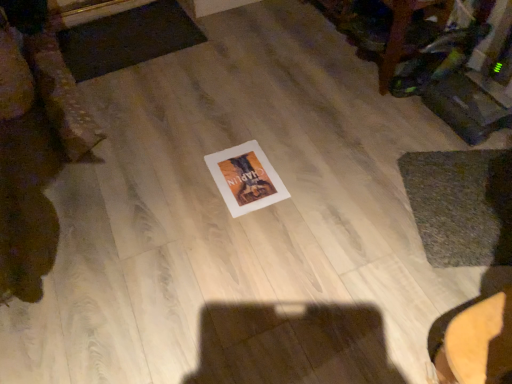
This screenshot has height=384, width=512. In order to click on green textured mat at lower right, which is counted as the 2th mat, starting from the left in this screenshot , I will do `click(461, 205)`.

Consider the image. Measure the distance between point (247, 173) and camera.

The distance of point (247, 173) from camera is 4.92 feet.

What do you see at coordinates (127, 39) in the screenshot?
I see `dark gray textured mat at upper left, which appears as the 1th mat when viewed from the top` at bounding box center [127, 39].

The image size is (512, 384). What are the coordinates of `wooden table at upper right` in the screenshot? It's located at (396, 38).

Considering the sizes of objects white paper at center and green textured mat at lower right, which is counted as the 2th mat, starting from the left, in the image provided, who is wider, white paper at center or green textured mat at lower right, which is counted as the 2th mat, starting from the left,?

Wider between the two is green textured mat at lower right, which is counted as the 2th mat, starting from the left.

Is white paper at center far from green textured mat at lower right, the 1th mat in the right-to-left sequence?

No, there isn't a large distance between white paper at center and green textured mat at lower right, the 1th mat in the right-to-left sequence.

From a real-world perspective, is white paper at center physically above green textured mat at lower right, marked as the second mat in a top-to-bottom arrangement?

Actually, white paper at center is physically below green textured mat at lower right, marked as the second mat in a top-to-bottom arrangement, in the real world.

Is white paper at center taller or shorter than green textured mat at lower right, marked as the second mat in a top-to-bottom arrangement?

white paper at center is shorter than green textured mat at lower right, marked as the second mat in a top-to-bottom arrangement.

How distant is dark gray textured mat at upper left, placed as the 2th mat when sorted from bottom to top, from green textured mat at lower right, which is counted as the 2th mat, starting from the back?

The distance of dark gray textured mat at upper left, placed as the 2th mat when sorted from bottom to top, from green textured mat at lower right, which is counted as the 2th mat, starting from the back, is 1.36 meters.

Where is `mat lying on the right of dark gray textured mat at upper left, which is the 2th mat in right-to-left order`? mat lying on the right of dark gray textured mat at upper left, which is the 2th mat in right-to-left order is located at coordinates (461, 205).

Relative to green textured mat at lower right, marked as the 1th mat in a bottom-to-top arrangement, is dark gray textured mat at upper left, which is the 1th mat from left to right, in front or behind?

Clearly, dark gray textured mat at upper left, which is the 1th mat from left to right, is behind green textured mat at lower right, marked as the 1th mat in a bottom-to-top arrangement.

Could dark gray textured mat at upper left, which is counted as the second mat, starting from the front, be considered to be inside wooden table at upper right?

No, dark gray textured mat at upper left, which is counted as the second mat, starting from the front, is not inside wooden table at upper right.

From the image's perspective, would you say wooden table at upper right is positioned over dark gray textured mat at upper left, the 1th mat viewed from the back?

Indeed, from the image's perspective, wooden table at upper right is shown above dark gray textured mat at upper left, the 1th mat viewed from the back.

From a real-world perspective, relative to dark gray textured mat at upper left, the 1th mat viewed from the back, is wooden table at upper right vertically above or below?

Clearly, from a real-world perspective, wooden table at upper right is above dark gray textured mat at upper left, the 1th mat viewed from the back.

Would you say wooden table at upper right is a long distance from dark gray textured mat at upper left, which is the 2th mat in right-to-left order?

No, there isn't a large distance between wooden table at upper right and dark gray textured mat at upper left, which is the 2th mat in right-to-left order.

Is white paper at center placed right next to dark gray textured mat at upper left, which is the 2th mat in right-to-left order?

white paper at center and dark gray textured mat at upper left, which is the 2th mat in right-to-left order, are not in contact.

Is white paper at center oriented towards dark gray textured mat at upper left, which appears as the 1th mat when viewed from the top?

No, white paper at center is not turned towards dark gray textured mat at upper left, which appears as the 1th mat when viewed from the top.

Between white paper at center and dark gray textured mat at upper left, placed as the 2th mat when sorted from bottom to top, which one has smaller size?

With smaller size is white paper at center.

Considering the points (252, 181) and (195, 37), which point is in front, point (252, 181) or point (195, 37)?

The point (252, 181) is in front.

Could you tell me if white paper at center is turned towards wooden table at upper right?

No, white paper at center is not facing towards wooden table at upper right.

From their relative heights in the image, would you say white paper at center is taller or shorter than wooden table at upper right?

Clearly, white paper at center is shorter compared to wooden table at upper right.

The width and height of the screenshot is (512, 384). Find the location of `postcard on the left of wooden table at upper right`. postcard on the left of wooden table at upper right is located at coordinates (246, 178).

Which object is more forward, dark gray textured mat at upper left, placed as the 2th mat when sorted from bottom to top, or wooden table at upper right?

wooden table at upper right is closer to the camera.

Which of these two, dark gray textured mat at upper left, the 1th mat viewed from the back, or wooden table at upper right, is bigger?

With larger size is wooden table at upper right.

From the image's perspective, is dark gray textured mat at upper left, placed as the 2th mat when sorted from bottom to top, below wooden table at upper right?

Yes, from the image's perspective, dark gray textured mat at upper left, placed as the 2th mat when sorted from bottom to top, is beneath wooden table at upper right.

Is dark gray textured mat at upper left, the 1th mat viewed from the back, turned away from wooden table at upper right?

dark gray textured mat at upper left, the 1th mat viewed from the back, is not turned away from wooden table at upper right.

Considering the relative sizes of wooden table at upper right and green textured mat at lower right, which is counted as the 2th mat, starting from the left, in the image provided, is wooden table at upper right taller than green textured mat at lower right, which is counted as the 2th mat, starting from the left,?

Yes, wooden table at upper right is taller than green textured mat at lower right, which is counted as the 2th mat, starting from the left.

Considering the sizes of wooden table at upper right and green textured mat at lower right, which appears as the 1th mat when viewed from the front, in the image, is wooden table at upper right bigger or smaller than green textured mat at lower right, which appears as the 1th mat when viewed from the front,?

Considering their sizes, wooden table at upper right takes up more space than green textured mat at lower right, which appears as the 1th mat when viewed from the front.

Is the position of wooden table at upper right less distant than that of green textured mat at lower right, which is counted as the 2th mat, starting from the left?

No, it is not.

Is wooden table at upper right inside or outside of green textured mat at lower right, which appears as the 1th mat when viewed from the front?

The correct answer is: outside.

At what (x,y) coordinates should I click in order to perform the action: click on the 2nd mat directly above the white paper at center (from a real-world perspective). Please return your answer as a coordinate pair (x, y). The image size is (512, 384). Looking at the image, I should click on click(x=461, y=205).

The width and height of the screenshot is (512, 384). What are the coordinates of `mat that is below the dark gray textured mat at upper left, placed as the 2th mat when sorted from bottom to top (from the image's perspective)` in the screenshot? It's located at (461, 205).

When comparing their distances from white paper at center, does wooden table at upper right or green textured mat at lower right, the 1th mat in the right-to-left sequence, seem closer?

The object closer to white paper at center is green textured mat at lower right, the 1th mat in the right-to-left sequence.

When comparing their distances from wooden table at upper right, does dark gray textured mat at upper left, which is counted as the second mat, starting from the front, or green textured mat at lower right, the 1th mat in the right-to-left sequence, seem closer?

green textured mat at lower right, the 1th mat in the right-to-left sequence, is closer to wooden table at upper right.

Looking at the image, which one is located further to green textured mat at lower right, marked as the second mat in a top-to-bottom arrangement, dark gray textured mat at upper left, which is counted as the second mat, starting from the front, or white paper at center?

Among the two, dark gray textured mat at upper left, which is counted as the second mat, starting from the front, is located further to green textured mat at lower right, marked as the second mat in a top-to-bottom arrangement.

Based on their spatial positions, is green textured mat at lower right, which is counted as the 2th mat, starting from the left, or white paper at center closer to wooden table at upper right?

Among the two, green textured mat at lower right, which is counted as the 2th mat, starting from the left, is located nearer to wooden table at upper right.

Which object lies nearer to the anchor point dark gray textured mat at upper left, which is the 2th mat in right-to-left order, green textured mat at lower right, the 1th mat in the right-to-left sequence, or white paper at center?

white paper at center lies closer to dark gray textured mat at upper left, which is the 2th mat in right-to-left order, than the other object.

Based on their spatial positions, is wooden table at upper right or dark gray textured mat at upper left, which is the 2th mat in right-to-left order, further from green textured mat at lower right, which is counted as the 2th mat, starting from the left?

dark gray textured mat at upper left, which is the 2th mat in right-to-left order.

Based on their spatial positions, is dark gray textured mat at upper left, placed as the 2th mat when sorted from bottom to top, or white paper at center closer to wooden table at upper right?

white paper at center is closer to wooden table at upper right.

Considering their positions, is green textured mat at lower right, the 1th mat in the right-to-left sequence, positioned further to dark gray textured mat at upper left, which is the 1th mat from left to right, than wooden table at upper right?

green textured mat at lower right, the 1th mat in the right-to-left sequence, is positioned further to the anchor dark gray textured mat at upper left, which is the 1th mat from left to right.

Where is `postcard between wooden table at upper right and green textured mat at lower right, marked as the second mat in a top-to-bottom arrangement, from top to bottom`? postcard between wooden table at upper right and green textured mat at lower right, marked as the second mat in a top-to-bottom arrangement, from top to bottom is located at coordinates (246, 178).

Find the location of `postcard located between dark gray textured mat at upper left, placed as the 2th mat when sorted from bottom to top, and green textured mat at lower right, which is counted as the 2th mat, starting from the back, in the left-right direction`. postcard located between dark gray textured mat at upper left, placed as the 2th mat when sorted from bottom to top, and green textured mat at lower right, which is counted as the 2th mat, starting from the back, in the left-right direction is located at coordinates (246, 178).

Where is `postcard between dark gray textured mat at upper left, which is the 1th mat from left to right, and wooden table at upper right from left to right`? postcard between dark gray textured mat at upper left, which is the 1th mat from left to right, and wooden table at upper right from left to right is located at coordinates (246, 178).

I want to click on furniture located between dark gray textured mat at upper left, which is the 1th mat from left to right, and green textured mat at lower right, marked as the second mat in a top-to-bottom arrangement, in the left-right direction, so click(396, 38).